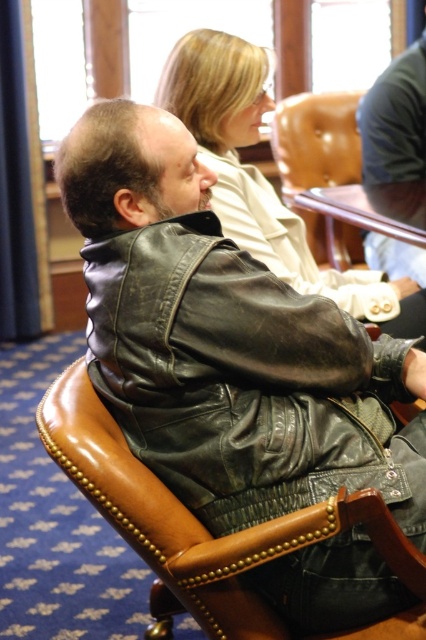
Question: Can you confirm if light beige leather jacket at upper center is wider than dark brown leather jacket at center?

Choices:
 (A) yes
 (B) no

Answer: (A)

Question: Which object is positioned closest to the light beige leather jacket at upper center?

Choices:
 (A) dark brown leather jacket at center
 (B) leather jacket at center
 (C) brown leather jacket at center

Answer: (A)

Question: Can you confirm if brown leather jacket at center is smaller than dark brown leather jacket at center?

Choices:
 (A) yes
 (B) no

Answer: (A)

Question: Which of the following is the closest to the observer?

Choices:
 (A) leather jacket at center
 (B) dark brown leather jacket at center
 (C) brown leather jacket at center
 (D) light beige leather jacket at upper center

Answer: (A)

Question: Among these objects, which one is nearest to the camera?

Choices:
 (A) light beige leather jacket at upper center
 (B) dark brown leather jacket at center
 (C) brown leather jacket at center
 (D) leather jacket at center

Answer: (D)

Question: Can you confirm if leather jacket at center is wider than brown leather jacket at center?

Choices:
 (A) no
 (B) yes

Answer: (B)